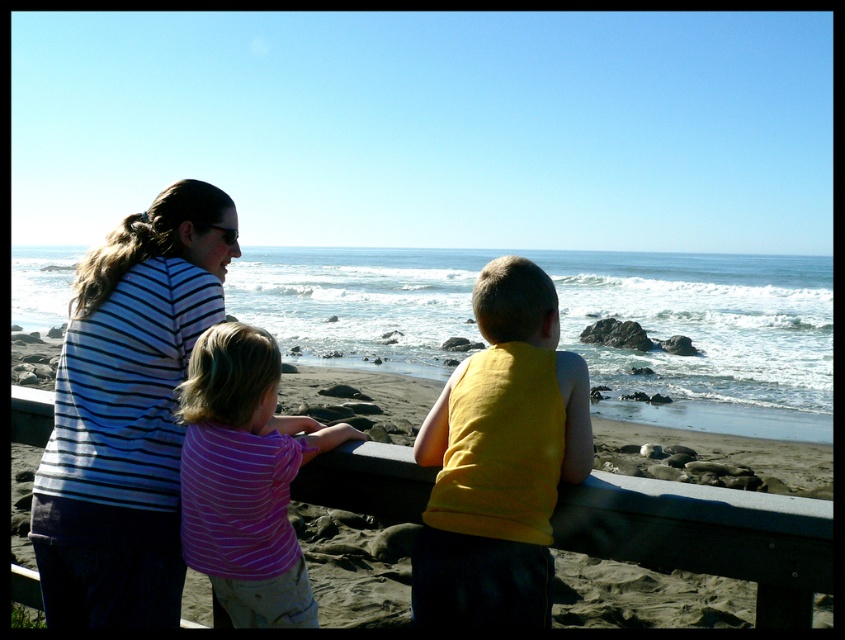
Question: Which of the following is the closest to the observer?

Choices:
 (A) (229, 512)
 (B) (461, 584)
 (C) (151, 490)

Answer: (B)

Question: Which object is positioned closest to the yellow cotton tank top at center?

Choices:
 (A) striped fabric shirt at left
 (B) purple striped shirt at center

Answer: (B)

Question: Is striped fabric shirt at left smaller than yellow cotton tank top at center?

Choices:
 (A) no
 (B) yes

Answer: (A)

Question: Is striped fabric shirt at left smaller than yellow cotton tank top at center?

Choices:
 (A) no
 (B) yes

Answer: (A)

Question: Is striped fabric shirt at left in front of purple striped shirt at center?

Choices:
 (A) no
 (B) yes

Answer: (A)

Question: Which object appears closest to the camera in this image?

Choices:
 (A) yellow cotton tank top at center
 (B) purple striped shirt at center
 (C) striped fabric shirt at left

Answer: (A)